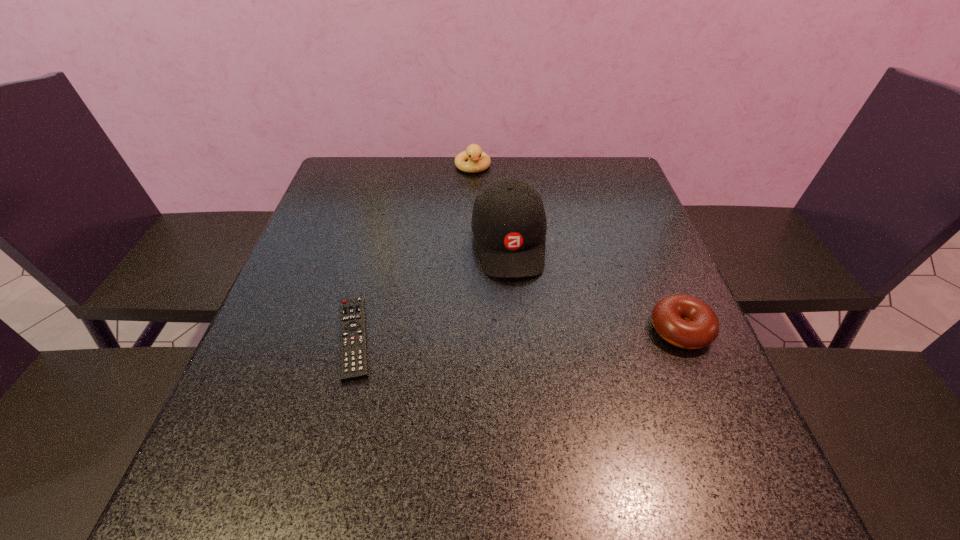
You are a GUI agent. You are given a task and a screenshot of the screen. Output one action in this format:
    pyautogui.click(x=<x>, y=<y>)
    Task: Click on the free space between the farthest object and the doughnut
    
    Given the screenshot: What is the action you would take?
    pyautogui.click(x=577, y=248)

You are a GUI agent. You are given a task and a screenshot of the screen. Output one action in this format:
    pyautogui.click(x=<x>, y=<y>)
    Task: Click on the object that is the second closest to the second shortest object
    Image resolution: width=960 pixels, height=540 pixels.
    Given the screenshot: What is the action you would take?
    pyautogui.click(x=353, y=346)

At what (x,y) coordinates should I click in order to perform the action: click on object identified as the closest to the doughnut. Please return your answer as a coordinate pair (x, y). This screenshot has height=540, width=960. Looking at the image, I should click on coord(509,224).

I want to click on vacant point that satisfies the following two spatial constraints: 1. on the front side of the second shortest object; 2. on the right side of the second farthest object, so click(x=515, y=330).

The height and width of the screenshot is (540, 960). Find the location of `free space that satisfies the following two spatial constraints: 1. on the front side of the tallest object; 2. on the right side of the third shortest object`. free space that satisfies the following two spatial constraints: 1. on the front side of the tallest object; 2. on the right side of the third shortest object is located at coordinates (470, 243).

The width and height of the screenshot is (960, 540). What are the coordinates of `vacant area that satisfies the following two spatial constraints: 1. on the back side of the leftmost object; 2. on the left side of the tallest object` in the screenshot? It's located at tap(378, 243).